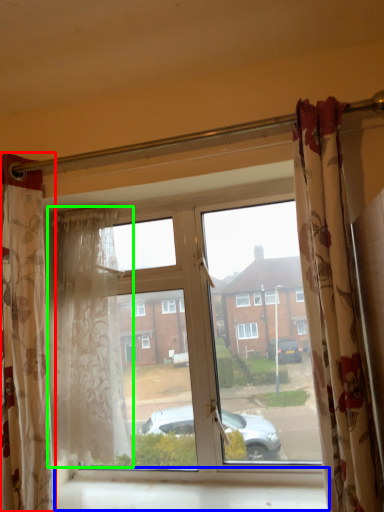
Question: Considering the real-world distances, which object is farthest from curtain (highlighted by a red box)? window sill (highlighted by a blue box) or curtain (highlighted by a green box)?

Choices:
 (A) window sill
 (B) curtain

Answer: (A)